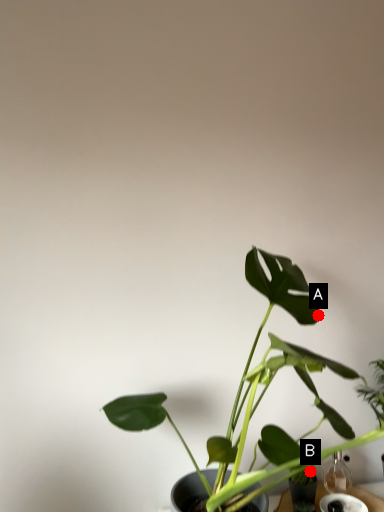
Question: Two points are circled on the image, labeled by A and B beside each circle. Which point is closer to the camera?

Choices:
 (A) A is closer
 (B) B is closer

Answer: (B)